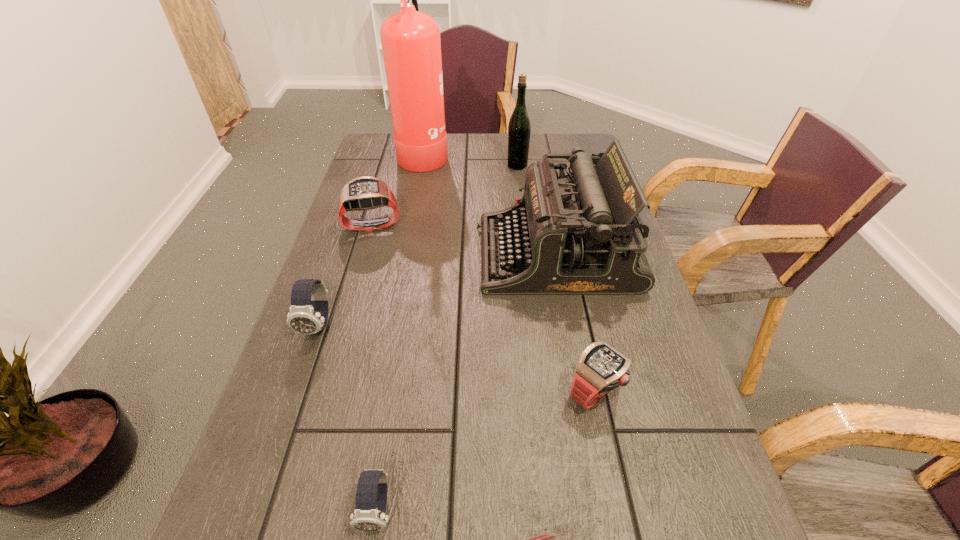
You are a GUI agent. You are given a task and a screenshot of the screen. Output one action in this format:
    pyautogui.click(x=<x>, y=<y>)
    Task: Click on the vacant space that is in between the farthest watch and the red fire extinguisher
    The height and width of the screenshot is (540, 960).
    Given the screenshot: What is the action you would take?
    pyautogui.click(x=398, y=189)

Identify the location of vacant space that is in between the fire extinguisher and the fourth nearest watch. The width and height of the screenshot is (960, 540). (372, 239).

What are the coordinates of `vacant space that is in between the fifth farthest object and the fire extinguisher` in the screenshot? It's located at (372, 239).

Locate an element on the screen. empty location between the farthest watch and the red fire extinguisher is located at coordinates (398, 189).

Locate an element on the screen. This screenshot has height=540, width=960. vacant space that's between the green beer bottle and the smaller dark watch is located at coordinates (x=447, y=338).

This screenshot has height=540, width=960. I want to click on free area in between the leftmost red watch and the typewriter, so 465,240.

At what (x,y) coordinates should I click in order to perform the action: click on blank region between the fire extinguisher and the biggest red watch. Please return your answer as a coordinate pair (x, y). Image resolution: width=960 pixels, height=540 pixels. Looking at the image, I should click on (398, 189).

The height and width of the screenshot is (540, 960). What are the coordinates of `free space between the second farthest watch and the typewriter` in the screenshot? It's located at (438, 290).

Identify the location of object that is the seventh closest to the farthest watch. (546, 539).

Select which object appears as the closest to the farther dark watch. Please provide its 2D coordinates. Your answer should be formatted as a tuple, i.e. [(x, y)], where the tuple contains the x and y coordinates of a point satisfying the conditions above.

[(363, 193)]